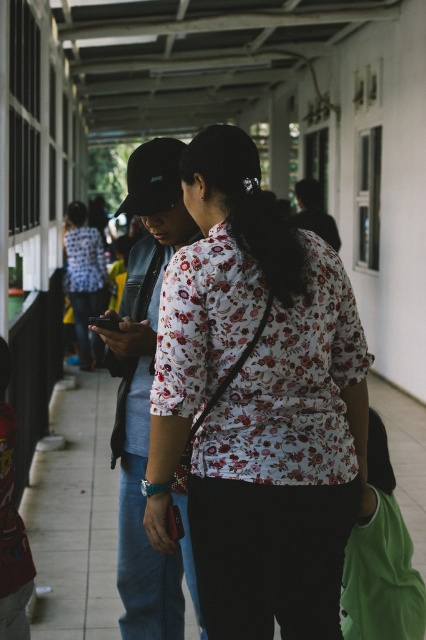
You are standing in the corridor and want to take a photo of the floral fabric shirt at center and the white tile pavement at center. Which object should you focus on first to ensure both are in focus?

The floral fabric shirt at center is closer to the viewer than the white tile pavement at center, so you should focus on the floral fabric shirt at center first to ensure both are in focus.

What is located at the coordinates point (75, 516) in the image?

The white tile pavement at center is located at point (75, 516).

Based on the photo, you are standing in the corridor and need to locate the floral fabric shirt at center. According to the coordinates provided, where should you look relative to the center of the image?

The floral fabric shirt at center is located at coordinates approximately 63.3 percent to the right and 60.6 percent down from the top left corner of the image.